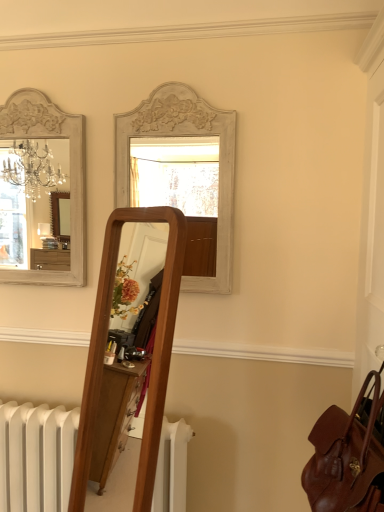
The image size is (384, 512). Find the location of `white painted wood mirror at upper center, positioned as the 2th mirror in left-to-right order`. white painted wood mirror at upper center, positioned as the 2th mirror in left-to-right order is located at coordinates (185, 136).

This screenshot has height=512, width=384. What do you see at coordinates (346, 459) in the screenshot?
I see `leather at right` at bounding box center [346, 459].

Identify the location of white painted wood mirror at upper left, which is counted as the 1th mirror, starting from the left. Image resolution: width=384 pixels, height=512 pixels. (24, 200).

Is there a large distance between white painted wood mirror at upper center, positioned as the 2th mirror in left-to-right order, and white painted wood mirror at upper left, which is counted as the 1th mirror, starting from the left?

white painted wood mirror at upper center, positioned as the 2th mirror in left-to-right order, is positioned a significant distance from white painted wood mirror at upper left, which is counted as the 1th mirror, starting from the left.

Does white painted wood mirror at upper center, which is counted as the first mirror, starting from the right, have a lesser height compared to white painted wood mirror at upper left, which is counted as the 1th mirror, starting from the left?

Correct, white painted wood mirror at upper center, which is counted as the first mirror, starting from the right, is not as tall as white painted wood mirror at upper left, which is counted as the 1th mirror, starting from the left.

Is white painted wood mirror at upper center, positioned as the 2th mirror in left-to-right order, further to the viewer compared to white painted wood mirror at upper left, the 2th mirror from the right?

No, it is in front of white painted wood mirror at upper left, the 2th mirror from the right.

From a real-world perspective, relative to white painted wood mirror at upper left, the 2th mirror from the right, is white painted wood mirror at upper center, positioned as the 2th mirror in left-to-right order, vertically above or below?

white painted wood mirror at upper center, positioned as the 2th mirror in left-to-right order, is situated lower than white painted wood mirror at upper left, the 2th mirror from the right, in the real world.

Is the surface of leather at right in direct contact with white painted wood mirror at upper center, which is counted as the first mirror, starting from the right?

No, leather at right is not next to white painted wood mirror at upper center, which is counted as the first mirror, starting from the right.

Image resolution: width=384 pixels, height=512 pixels. Find the location of `bag below the white painted wood mirror at upper center, which is counted as the first mirror, starting from the right (from a real-world perspective)`. bag below the white painted wood mirror at upper center, which is counted as the first mirror, starting from the right (from a real-world perspective) is located at coordinates (346, 459).

From the image's perspective, is leather at right above or below white painted wood mirror at upper center, positioned as the 2th mirror in left-to-right order?

From the image's perspective, leather at right appears below white painted wood mirror at upper center, positioned as the 2th mirror in left-to-right order.

From a real-world perspective, between white painted wood mirror at upper left, the 2th mirror from the right, and leather at right, who is vertically lower?

From a 3D spatial view, leather at right is below.

Consider the image. Between white painted wood mirror at upper left, which is counted as the 1th mirror, starting from the left, and leather at right, which one has larger width?

leather at right.

Would you say leather at right is part of white painted wood mirror at upper left, which is counted as the 1th mirror, starting from the left,'s contents?

No, leather at right is not inside white painted wood mirror at upper left, which is counted as the 1th mirror, starting from the left.

Which object is closer to the camera, white painted wood mirror at upper left, which is counted as the 1th mirror, starting from the left, or leather at right?

leather at right is more forward.

Can you tell me how much white painted wood mirror at upper center, positioned as the 2th mirror in left-to-right order, and leather at right differ in facing direction?

They differ by 89.7 degrees in their facing directions.

Is white painted wood mirror at upper center, positioned as the 2th mirror in left-to-right order, bigger or smaller than leather at right?

white painted wood mirror at upper center, positioned as the 2th mirror in left-to-right order, is smaller than leather at right.

Image resolution: width=384 pixels, height=512 pixels. In the image, there is a white painted wood mirror at upper center, positioned as the 2th mirror in left-to-right order. What are the coordinates of `bag below it (from a real-world perspective)` in the screenshot? It's located at (346, 459).

Considering the relative sizes of leather at right and white painted wood mirror at upper left, the 2th mirror from the right, in the image provided, is leather at right wider than white painted wood mirror at upper left, the 2th mirror from the right,?

Yes.

Is leather at right inside or outside of white painted wood mirror at upper left, which is counted as the 1th mirror, starting from the left?

leather at right is outside white painted wood mirror at upper left, which is counted as the 1th mirror, starting from the left.

Could you tell me if leather at right is facing white painted wood mirror at upper left, the 2th mirror from the right?

No, leather at right does not turn towards white painted wood mirror at upper left, the 2th mirror from the right.

From a real-world perspective, is leather at right over white painted wood mirror at upper left, the 2th mirror from the right?

Actually, leather at right is physically below white painted wood mirror at upper left, the 2th mirror from the right, in the real world.

Could you measure the distance between white painted wood mirror at upper left, the 2th mirror from the right, and white painted wood mirror at upper center, which is counted as the first mirror, starting from the right?

white painted wood mirror at upper left, the 2th mirror from the right, and white painted wood mirror at upper center, which is counted as the first mirror, starting from the right, are 2.45 meters apart from each other.

What's the angular difference between white painted wood mirror at upper left, which is counted as the 1th mirror, starting from the left, and white painted wood mirror at upper center, which is counted as the first mirror, starting from the right,'s facing directions?

0.415 degrees.

From the image's perspective, between white painted wood mirror at upper left, the 2th mirror from the right, and white painted wood mirror at upper center, positioned as the 2th mirror in left-to-right order, which one is located above?

white painted wood mirror at upper left, the 2th mirror from the right, is shown above in the image.

Does white painted wood mirror at upper left, which is counted as the 1th mirror, starting from the left, turn towards white painted wood mirror at upper center, which is counted as the first mirror, starting from the right?

No, white painted wood mirror at upper left, which is counted as the 1th mirror, starting from the left, is not turned towards white painted wood mirror at upper center, which is counted as the first mirror, starting from the right.

The image size is (384, 512). Identify the location of mirror below the white painted wood mirror at upper left, which is counted as the 1th mirror, starting from the left (from the image's perspective). (x=185, y=136).

Where is `bag in front of the white painted wood mirror at upper center, which is counted as the first mirror, starting from the right`? Image resolution: width=384 pixels, height=512 pixels. bag in front of the white painted wood mirror at upper center, which is counted as the first mirror, starting from the right is located at coordinates [x=346, y=459].

From the image, which object appears to be nearer to white painted wood mirror at upper center, positioned as the 2th mirror in left-to-right order, leather at right or white painted wood mirror at upper left, the 2th mirror from the right?

Based on the image, leather at right appears to be nearer to white painted wood mirror at upper center, positioned as the 2th mirror in left-to-right order.

Considering their positions, is leather at right positioned closer to white painted wood mirror at upper left, the 2th mirror from the right, than white painted wood mirror at upper center, positioned as the 2th mirror in left-to-right order?

Among the two, white painted wood mirror at upper center, positioned as the 2th mirror in left-to-right order, is located nearer to white painted wood mirror at upper left, the 2th mirror from the right.

Based on their spatial positions, is white painted wood mirror at upper left, the 2th mirror from the right, or white painted wood mirror at upper center, positioned as the 2th mirror in left-to-right order, further from leather at right?

The object further to leather at right is white painted wood mirror at upper left, the 2th mirror from the right.

Which object lies nearer to the anchor point white painted wood mirror at upper center, which is counted as the first mirror, starting from the right, white painted wood mirror at upper left, which is counted as the 1th mirror, starting from the left, or leather at right?

leather at right lies closer to white painted wood mirror at upper center, which is counted as the first mirror, starting from the right, than the other object.

From the picture: Estimate the real-world distances between objects in this image. Which object is further from white painted wood mirror at upper left, the 2th mirror from the right, white painted wood mirror at upper center, which is counted as the first mirror, starting from the right, or leather at right?

Among the two, leather at right is located further to white painted wood mirror at upper left, the 2th mirror from the right.

When comparing their distances from leather at right, does white painted wood mirror at upper center, which is counted as the first mirror, starting from the right, or white painted wood mirror at upper left, the 2th mirror from the right, seem closer?

white painted wood mirror at upper center, which is counted as the first mirror, starting from the right.

This screenshot has height=512, width=384. In order to click on mirror between white painted wood mirror at upper left, which is counted as the 1th mirror, starting from the left, and leather at right from left to right in this screenshot , I will do `click(185, 136)`.